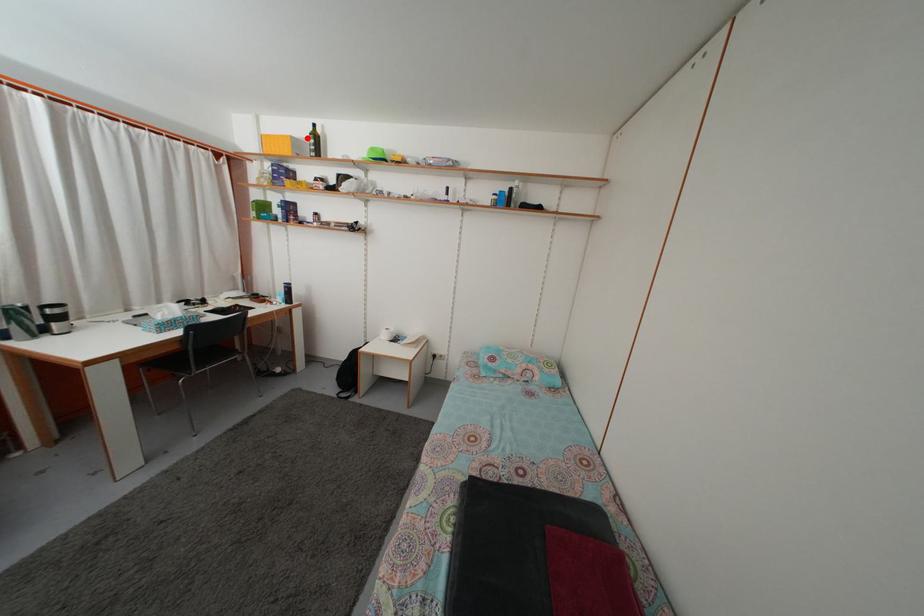
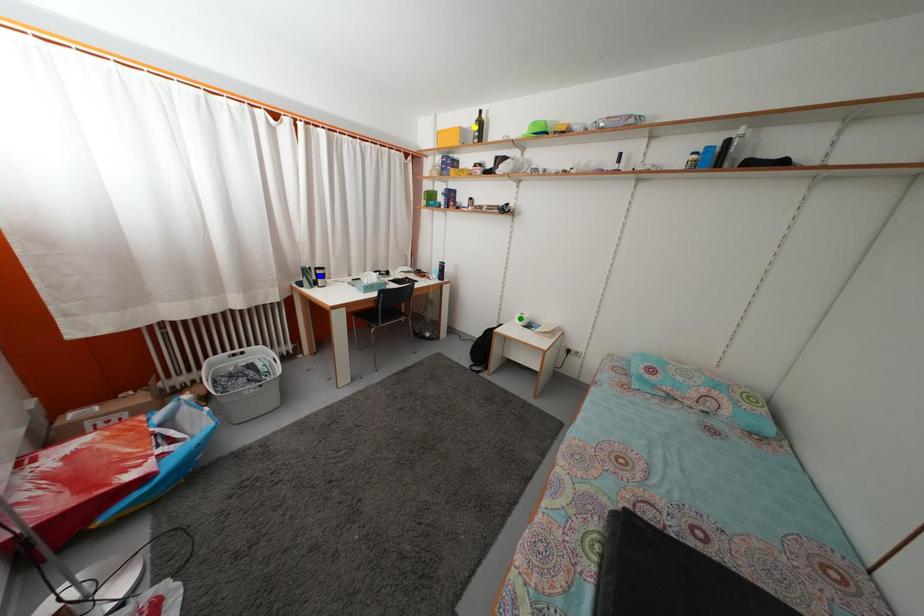
Question: I am providing you with two images of the same scene from different viewpoints. A red point is marked on the first image. You are given multiple points on the second image. Which point in image 2 represents the same 3d spot as the red point in image 1?

Choices:
 (A) blue point
 (B) yellow point
 (C) green point

Answer: (B)